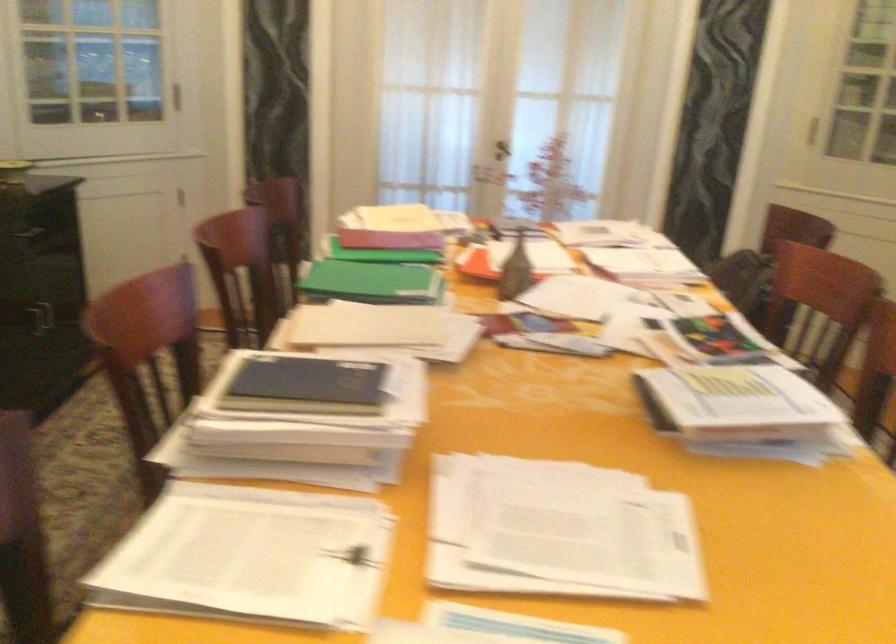
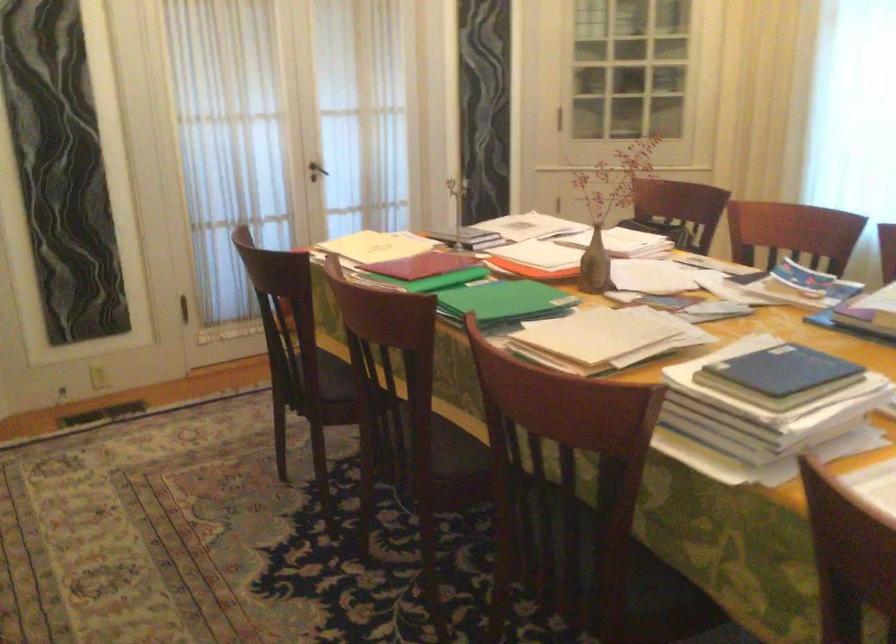
In the second image, find the point that corresponds to (x=371, y=281) in the first image.

(504, 301)